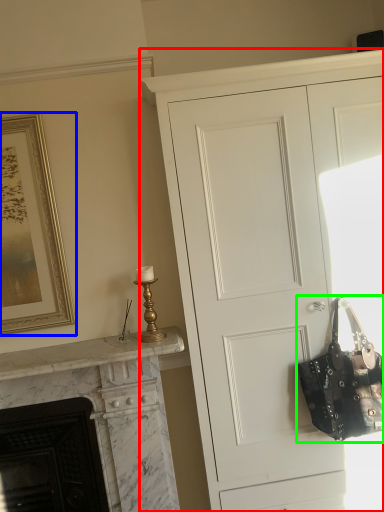
Question: Estimate the real-world distances between objects in this image. Which object is closer to cupboard (highlighted by a red box), picture frame (highlighted by a blue box) or handbag (highlighted by a green box)?

Choices:
 (A) picture frame
 (B) handbag

Answer: (B)